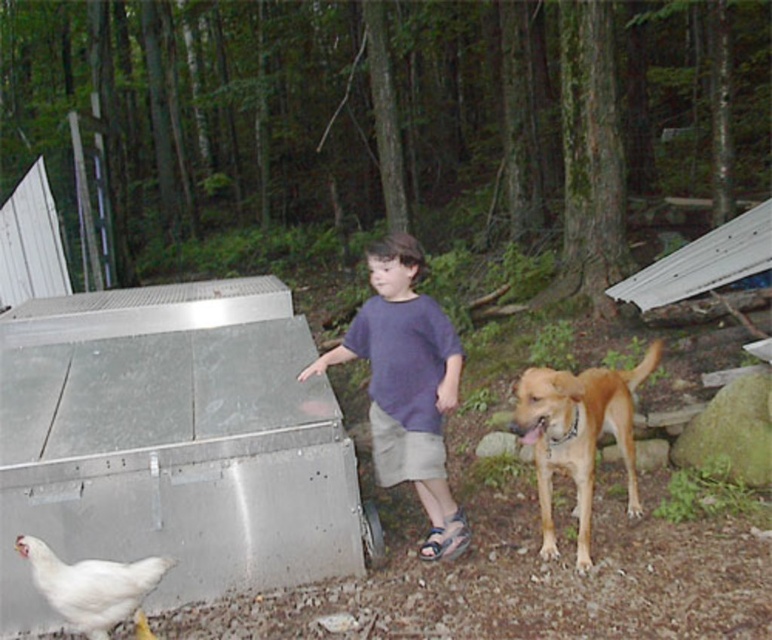
You are standing at the point marked as point (579, 435). What do you see at that location?

At point (579, 435) lies a golden fur dog at center.

You are standing in a wooded area and see a purple cotton shirt at center and a white matte chicken at lower left. Which object is closer to your right side?

The purple cotton shirt at center is to the right of the white matte chicken at lower left, so the purple cotton shirt at center is closer to your right side.